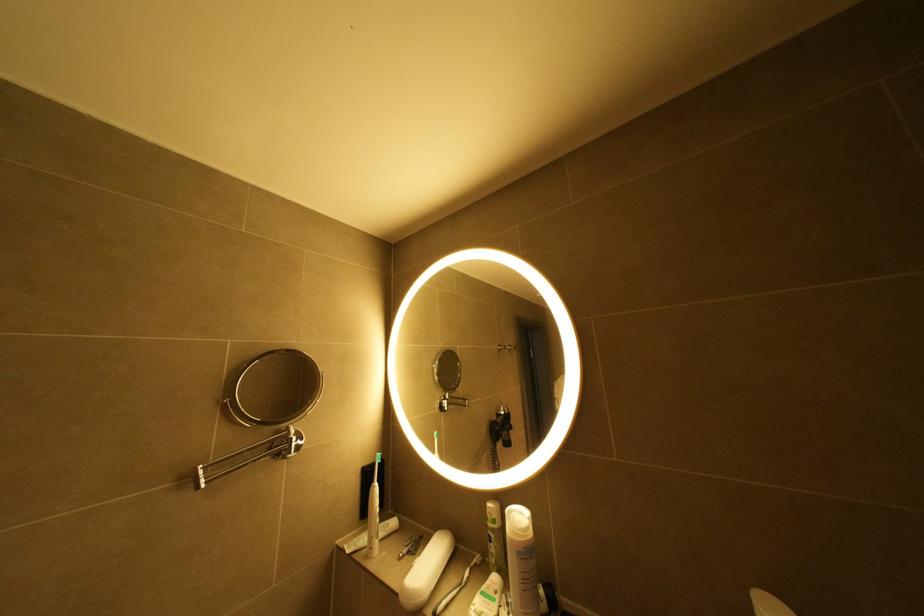
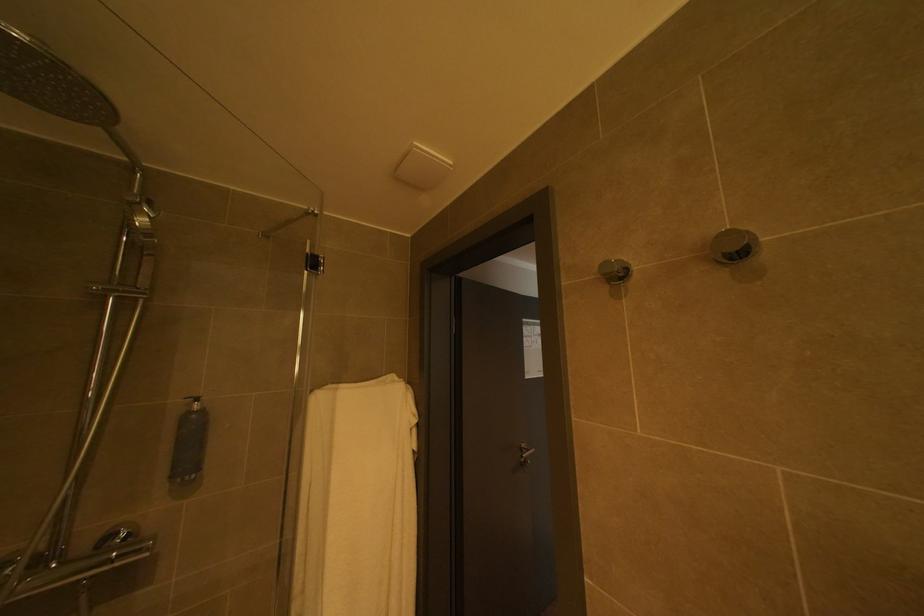
Question: How did the camera likely rotate?

Choices:
 (A) Left
 (B) Right
 (C) Up
 (D) Down

Answer: (A)